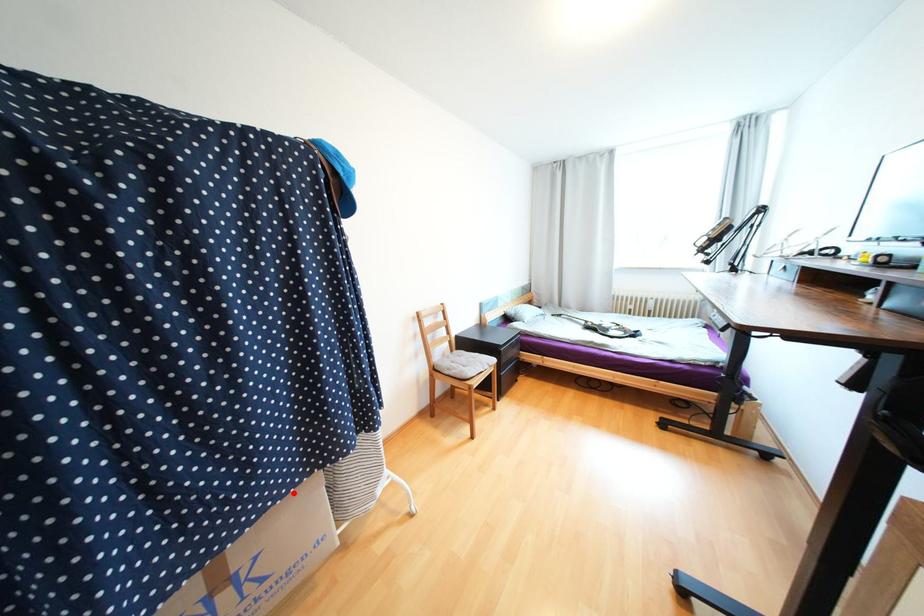
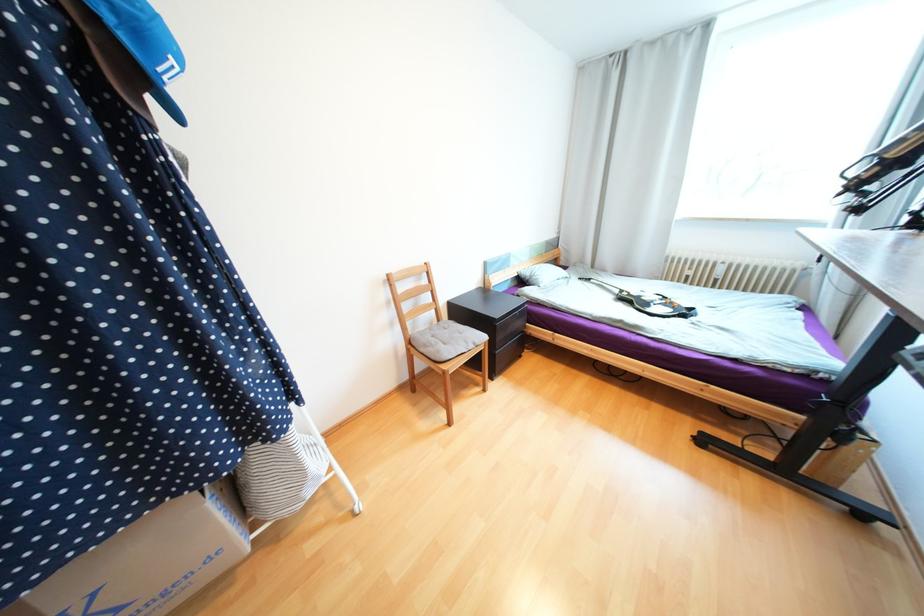
Find the pixel in the second image that matches the highlighted location in the first image.

(116, 535)